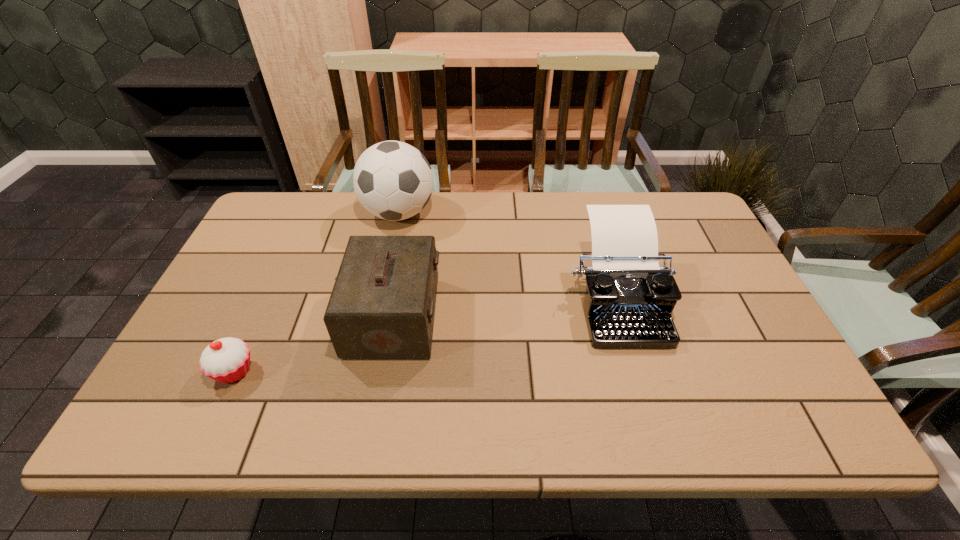
You are a GUI agent. You are given a task and a screenshot of the screen. Output one action in this format:
    pyautogui.click(x=<x>, y=<y>)
    Task: Click on the soccer ball
    The width and height of the screenshot is (960, 540).
    Given the screenshot: What is the action you would take?
    pyautogui.click(x=393, y=180)

Locate an element on the screen. the tallest object is located at coordinates (393, 180).

Locate an element on the screen. The image size is (960, 540). the first-aid kit is located at coordinates (382, 306).

Image resolution: width=960 pixels, height=540 pixels. I want to click on typewriter, so click(x=628, y=304).

I want to click on the leftmost object, so click(227, 360).

Where is `cupcake`? The width and height of the screenshot is (960, 540). cupcake is located at coordinates (227, 360).

Find the location of a particular element. free space located 0.270m on the right of the soccer ball is located at coordinates (518, 213).

Where is `vacant position located 0.100m on the back of the first-aid kit`? vacant position located 0.100m on the back of the first-aid kit is located at coordinates (405, 256).

The width and height of the screenshot is (960, 540). I want to click on free space located 0.170m on the keys of the typewriter, so click(651, 416).

I want to click on vacant space positioned 0.270m on the back of the cupcake, so click(x=279, y=273).